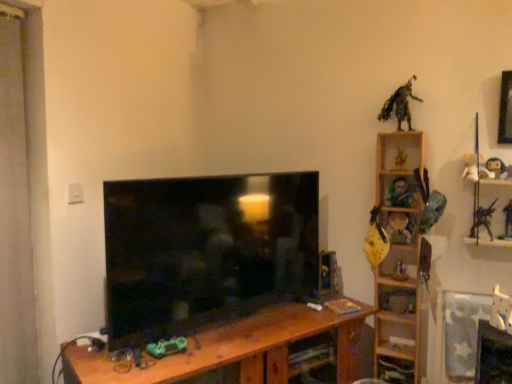
In order to click on vacant region to the right of green matte toy car at center, which appears as the 12th toy when viewed from the right in this screenshot , I will do `click(209, 349)`.